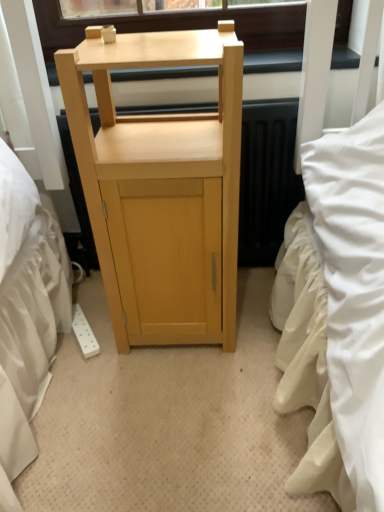
Locate an element on the screen. light wood cabinet at center is located at coordinates (162, 189).

Describe the element at coordinates (162, 189) in the screenshot. The image size is (384, 512). I see `light wood cabinet at center` at that location.

What do you see at coordinates (179, 25) in the screenshot? The height and width of the screenshot is (512, 384). I see `matte wood table at upper center` at bounding box center [179, 25].

This screenshot has width=384, height=512. In order to click on matte wood table at upper center in this screenshot , I will do `click(179, 25)`.

Identify the location of light wood cabinet at center. The image size is (384, 512). (162, 189).

Is matte wood table at upper center to the left of light wood cabinet at center from the viewer's perspective?

Incorrect, matte wood table at upper center is not on the left side of light wood cabinet at center.

Which object is more forward, matte wood table at upper center or light wood cabinet at center?

light wood cabinet at center is more forward.

Considering the points (291, 23) and (133, 322), which point is in front, point (291, 23) or point (133, 322)?

The point (133, 322) is closer.

From the image's perspective, would you say matte wood table at upper center is positioned over light wood cabinet at center?

Yes, from the image's perspective, matte wood table at upper center is above light wood cabinet at center.

From a real-world perspective, is matte wood table at upper center physically located above or below light wood cabinet at center?

Clearly, from a real-world perspective, matte wood table at upper center is above light wood cabinet at center.

Between matte wood table at upper center and light wood cabinet at center, which one has smaller width?

matte wood table at upper center.

Who is taller, matte wood table at upper center or light wood cabinet at center?

With more height is light wood cabinet at center.

Is matte wood table at upper center bigger than light wood cabinet at center?

No, matte wood table at upper center is not bigger than light wood cabinet at center.

Is matte wood table at upper center inside the boundaries of light wood cabinet at center, or outside?

matte wood table at upper center is outside light wood cabinet at center.

Is matte wood table at upper center beside light wood cabinet at center?

matte wood table at upper center and light wood cabinet at center are not in contact.

Is matte wood table at upper center facing away from light wood cabinet at center?

No, light wood cabinet at center is not at the back of matte wood table at upper center.

How many degrees apart are the facing directions of matte wood table at upper center and light wood cabinet at center?

They differ by 0.116 degrees in their facing directions.

At what (x,y) coordinates should I click in order to perform the action: click on furniture on the left of matte wood table at upper center. Please return your answer as a coordinate pair (x, y). The image size is (384, 512). Looking at the image, I should click on (162, 189).

Considering the relative positions of light wood cabinet at center and matte wood table at upper center in the image provided, is light wood cabinet at center to the left of matte wood table at upper center from the viewer's perspective?

Correct, you'll find light wood cabinet at center to the left of matte wood table at upper center.

Which object is further away from the camera taking this photo, light wood cabinet at center or matte wood table at upper center?

Positioned behind is matte wood table at upper center.

Is point (215, 285) less distant than point (254, 20)?

Yes, point (215, 285) is closer to viewer.

From the image's perspective, who appears lower, light wood cabinet at center or matte wood table at upper center?

light wood cabinet at center is shown below in the image.

From a real-world perspective, is light wood cabinet at center on matte wood table at upper center?

No, from a real-world perspective, light wood cabinet at center is not on top of matte wood table at upper center.

Considering the sizes of objects light wood cabinet at center and matte wood table at upper center in the image provided, who is thinner, light wood cabinet at center or matte wood table at upper center?

matte wood table at upper center is thinner.

Is light wood cabinet at center taller or shorter than matte wood table at upper center?

Considering their sizes, light wood cabinet at center has more height than matte wood table at upper center.

Consider the image. Which of these two, light wood cabinet at center or matte wood table at upper center, is bigger?

light wood cabinet at center.

Is light wood cabinet at center not within matte wood table at upper center?

Yes, light wood cabinet at center is located beyond the bounds of matte wood table at upper center.

Is light wood cabinet at center far from matte wood table at upper center?

No.

Is light wood cabinet at center oriented away from matte wood table at upper center?

Absolutely, light wood cabinet at center is directed away from matte wood table at upper center.

You are a GUI agent. You are given a task and a screenshot of the screen. Output one action in this format:
    pyautogui.click(x=<x>, y=<y>)
    Task: Click on the window screen above the light wood cabinet at center (from a real-world perspective)
    The height and width of the screenshot is (512, 384).
    Given the screenshot: What is the action you would take?
    179,25

What are the coordinates of `furniture below the matte wood table at upper center (from a real-world perspective)` in the screenshot? It's located at (162, 189).

The width and height of the screenshot is (384, 512). What are the coordinates of `window screen lying behind the light wood cabinet at center` in the screenshot? It's located at (179, 25).